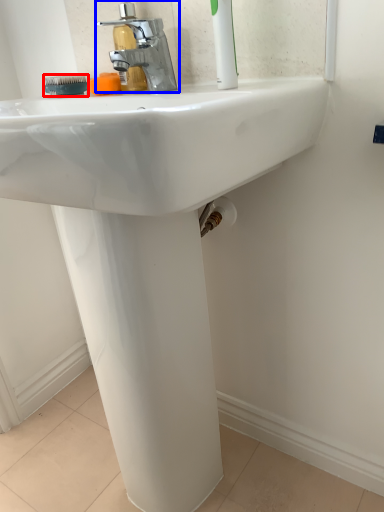
Question: Among these objects, which one is nearest to the camera, brush (highlighted by a red box) or tap (highlighted by a blue box)?

Choices:
 (A) brush
 (B) tap

Answer: (B)